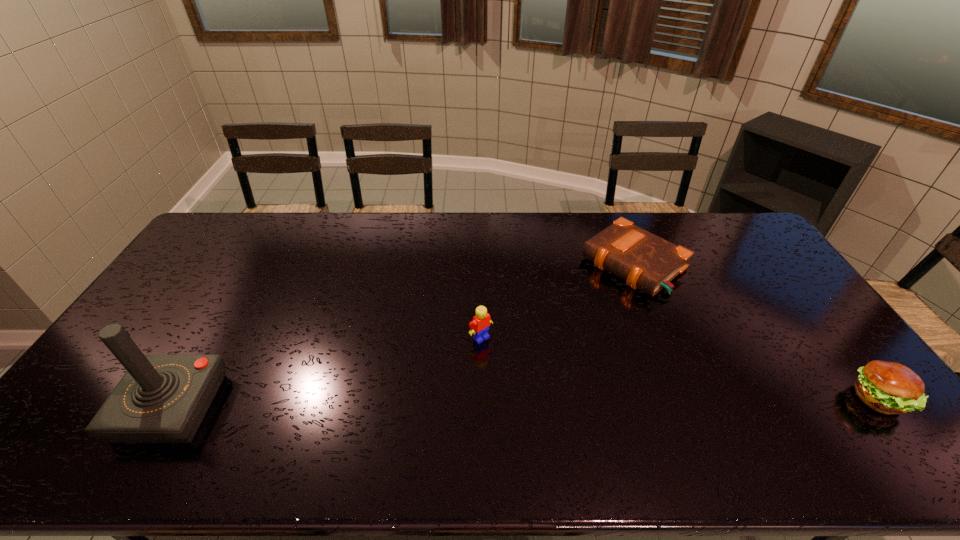
The height and width of the screenshot is (540, 960). Find the location of `object that is at the right edge`. object that is at the right edge is located at coordinates [887, 387].

The height and width of the screenshot is (540, 960). I want to click on object that is at the near left corner, so click(161, 398).

You are a GUI agent. You are given a task and a screenshot of the screen. Output one action in this format:
    pyautogui.click(x=<x>, y=<y>)
    Task: Click on the object that is at the near right corner
    This screenshot has height=540, width=960.
    Given the screenshot: What is the action you would take?
    pyautogui.click(x=887, y=387)

Where is `vacant space at the far edge of the desktop`? vacant space at the far edge of the desktop is located at coordinates (591, 214).

Where is `vacant area at the near edge`? The image size is (960, 540). vacant area at the near edge is located at coordinates (335, 402).

This screenshot has width=960, height=540. I want to click on free space at the left edge of the desktop, so click(x=146, y=351).

Find the location of a particular element. The image size is (960, 540). free space at the right edge of the desktop is located at coordinates (745, 261).

Identify the location of free space that is in between the Bible and the Lego. (557, 301).

Where is `vacant area between the Lego and the rightmost object`? The image size is (960, 540). vacant area between the Lego and the rightmost object is located at coordinates (680, 368).

Where is `free space between the tallest object and the second object from left to right`? The width and height of the screenshot is (960, 540). free space between the tallest object and the second object from left to right is located at coordinates (326, 373).